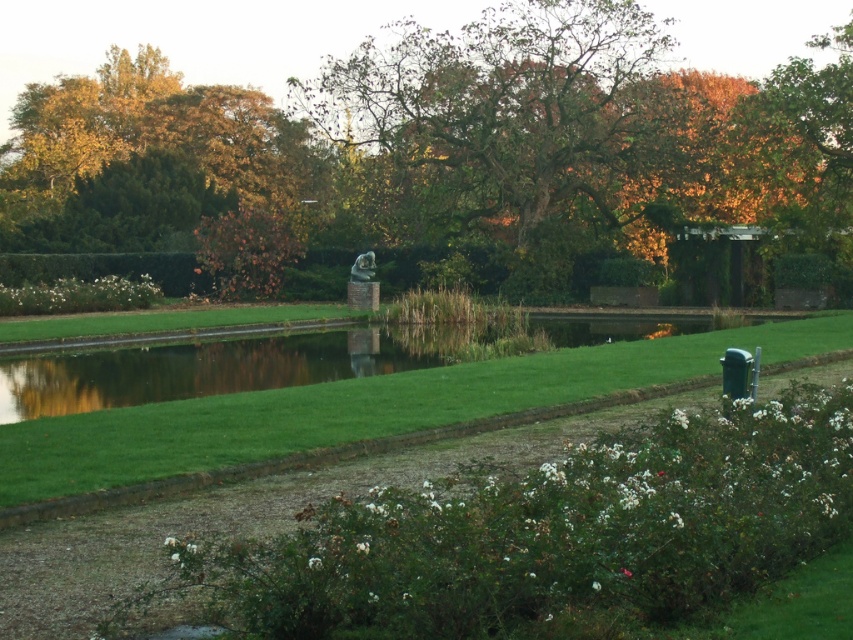
Question: Can you confirm if green grass at center is positioned to the right of golden foliage at upper left?

Choices:
 (A) no
 (B) yes

Answer: (B)

Question: Does green grass at center appear on the right side of golden foliage at upper left?

Choices:
 (A) yes
 (B) no

Answer: (A)

Question: Which point is farther to the camera?

Choices:
 (A) (402, 419)
 (B) (107, 148)
 (C) (390, 90)

Answer: (B)

Question: Considering the real-world distances, which object is farthest from the golden foliage at upper left?

Choices:
 (A) green grass at center
 (B) green leafy tree at center

Answer: (A)

Question: Considering the real-world distances, which object is closest to the golden foliage at upper left?

Choices:
 (A) green leafy tree at center
 (B) green grass at center

Answer: (A)

Question: Is the position of green leafy tree at center more distant than that of golden foliage at upper left?

Choices:
 (A) yes
 (B) no

Answer: (B)